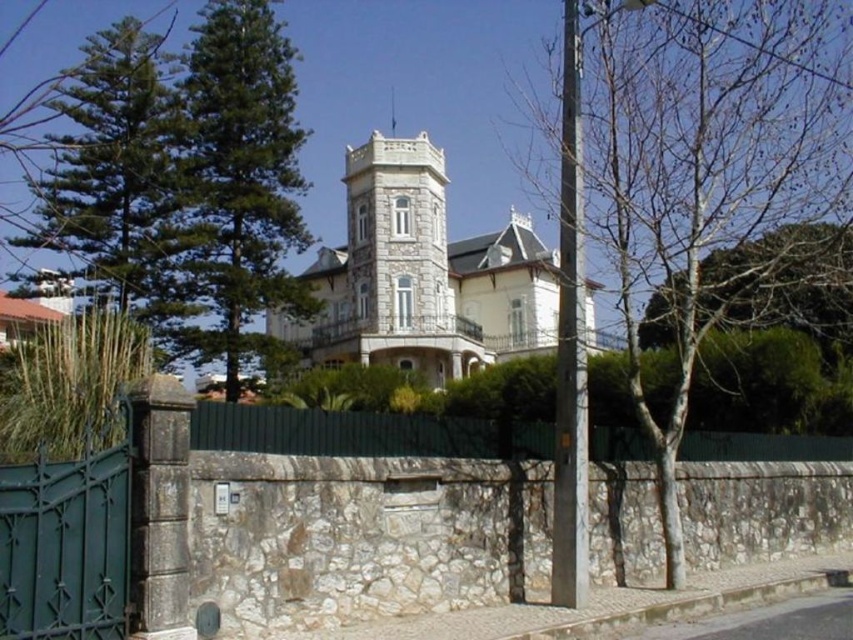
Question: Can you confirm if bare wood tree at center is bigger than green metal fence at lower center?

Choices:
 (A) yes
 (B) no

Answer: (A)

Question: Which object is positioned farthest from the green wrought iron gate at lower left?

Choices:
 (A) bare wood tree at center
 (B) green metal fence at lower center
 (C) green leafy tree at left
 (D) green needle-like foliage at left

Answer: (D)

Question: Observing the image, what is the correct spatial positioning of bare wood tree at center in reference to green leafy tree at left?

Choices:
 (A) right
 (B) left

Answer: (A)

Question: Which object is the closest to the green needle-like foliage at left?

Choices:
 (A) green leafy tree at left
 (B) green wrought iron gate at lower left

Answer: (A)

Question: Which object appears closest to the camera in this image?

Choices:
 (A) bare wood tree at center
 (B) green metal fence at lower center
 (C) green leafy tree at left

Answer: (B)

Question: Is bare wood tree at center positioned behind green leafy tree at left?

Choices:
 (A) yes
 (B) no

Answer: (B)